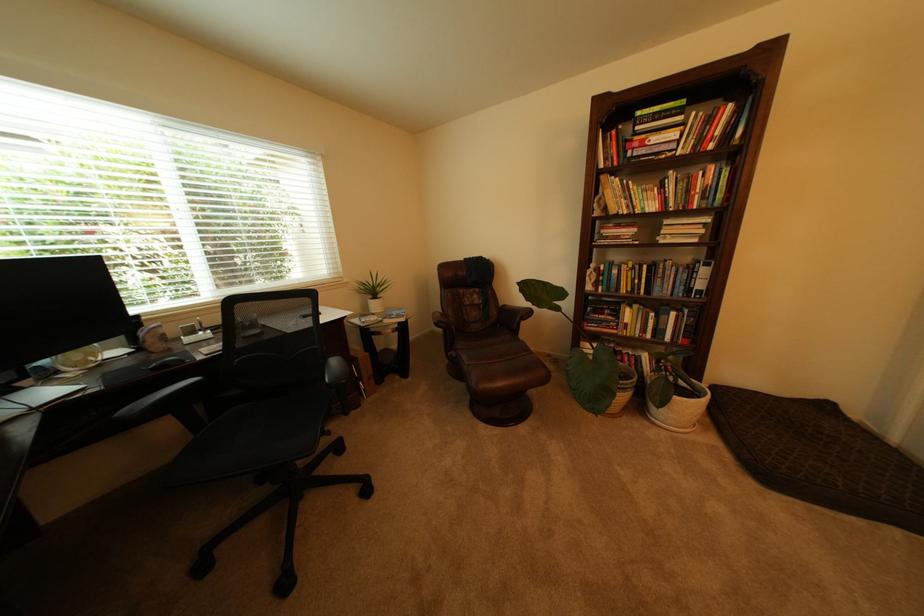
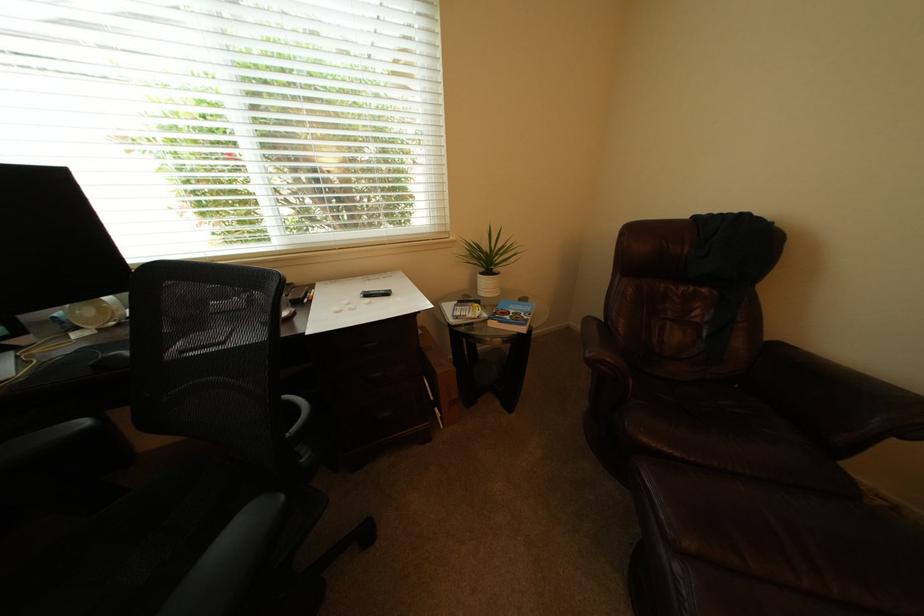
Locate, in the second image, the point that corresponds to point (391, 321) in the first image.

(495, 317)